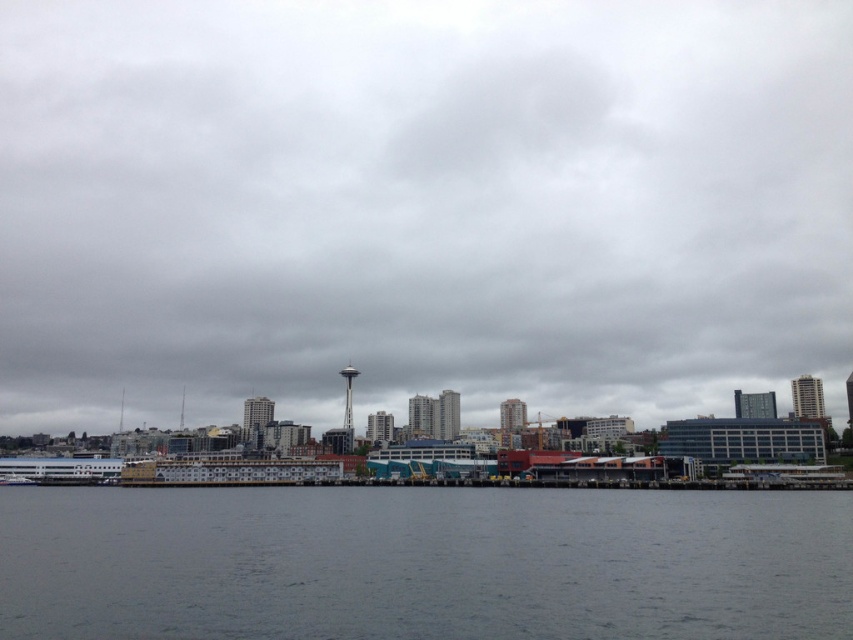
Between gray cloudy sky at center and gray water at lower center, which one is positioned lower?

Positioned lower is gray water at lower center.

Between gray cloudy sky at center and gray water at lower center, which one appears on the left side from the viewer's perspective?

gray cloudy sky at center is more to the left.

Who is more forward, (28,131) or (328,621)?

Point (328,621)

Locate an element on the screen. The height and width of the screenshot is (640, 853). gray cloudy sky at center is located at coordinates (421, 205).